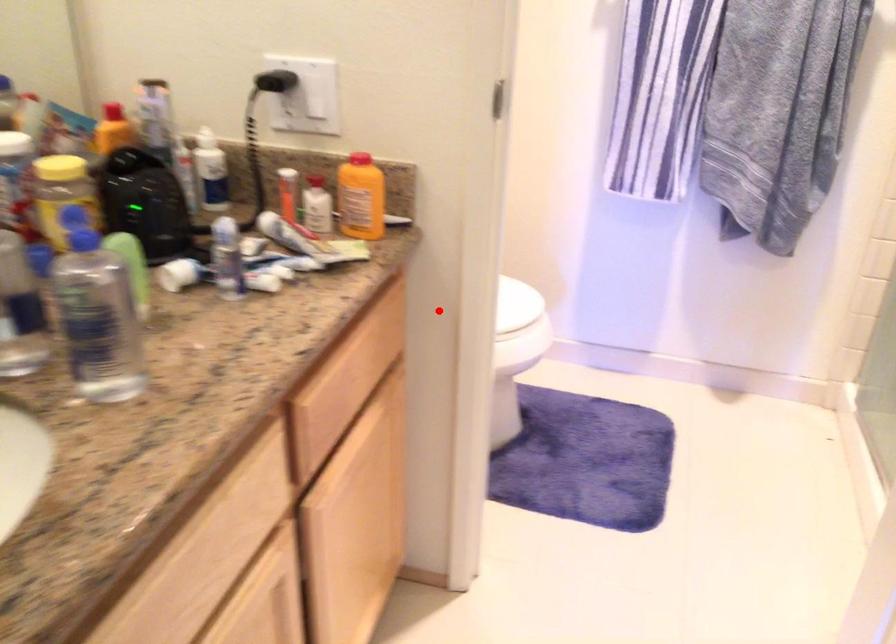
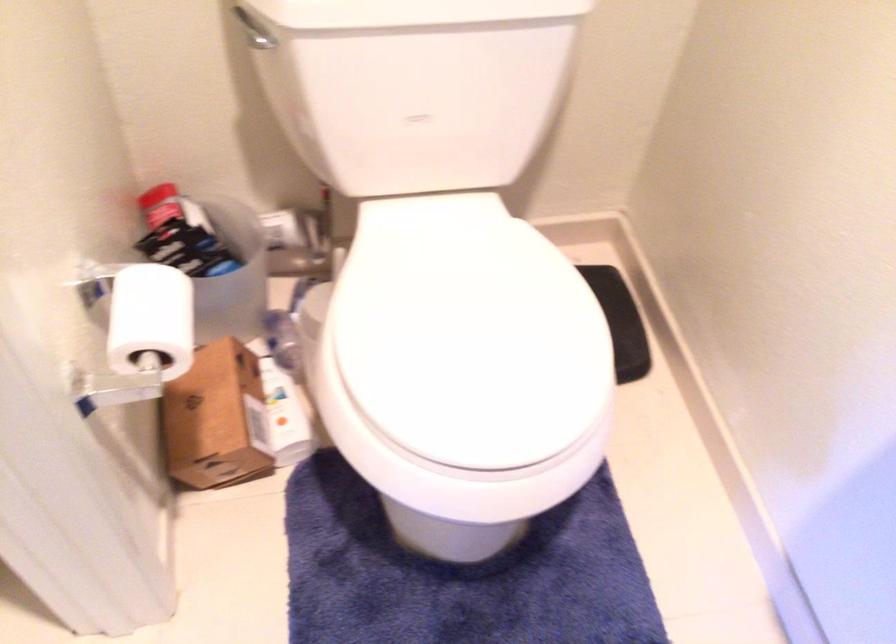
Question: I am providing you with two images of the same scene from different viewpoints. Given a red point in image1, look at the same physical point in image2. Is it:

Choices:
 (A) Closer to the viewpoint
 (B) Farther from the viewpoint

Answer: (A)